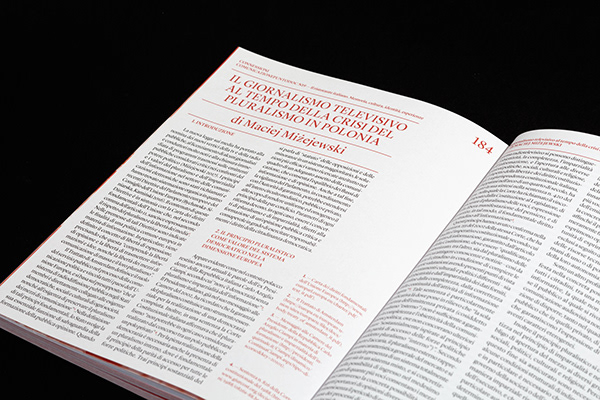
Where is `book`? book is located at coordinates (394, 211).